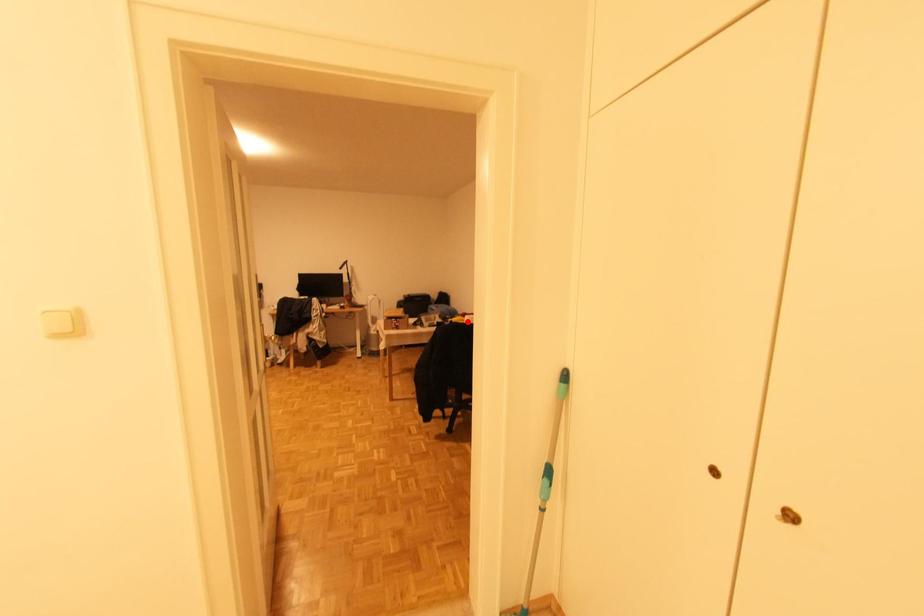
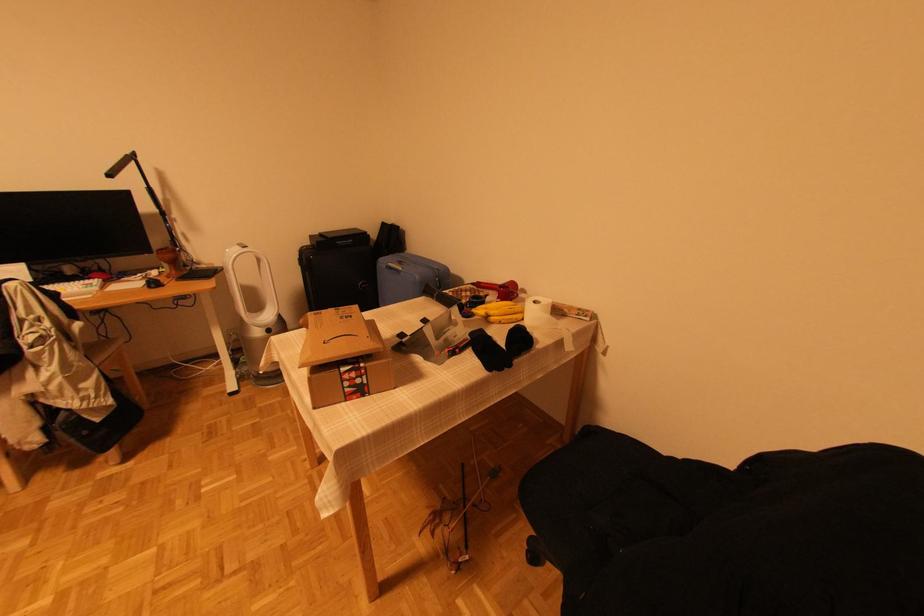
Question: I am providing you with two images of the same scene from different viewpoints. A red point is shown in image1. For the corresponding object point in image2, is it positioned nearer or farther from the camera?

Choices:
 (A) Nearer
 (B) Farther

Answer: (A)